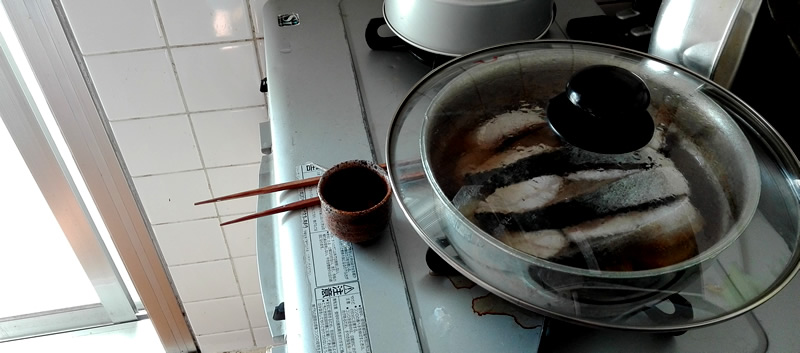
Identify the location of lid handle. (594, 120).